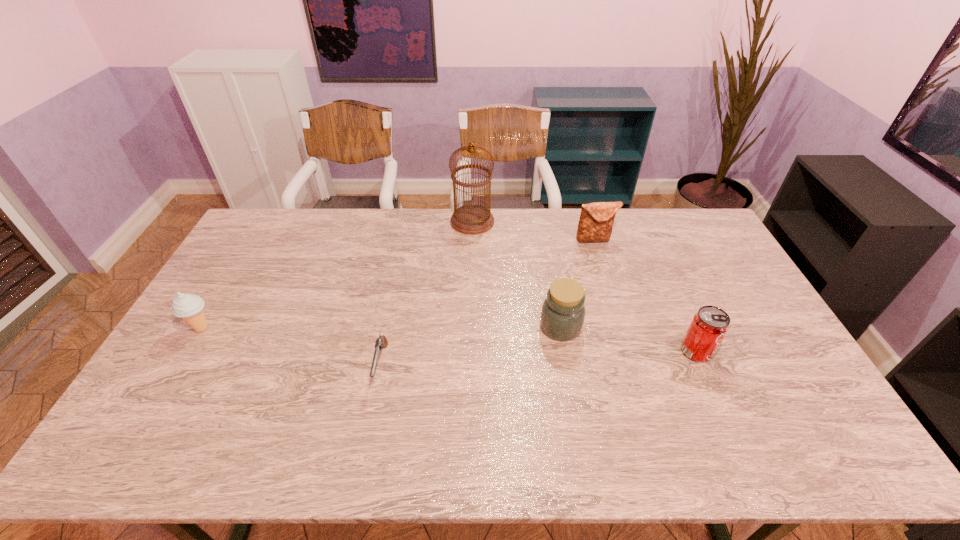
Locate an element on the screen. This screenshot has height=540, width=960. vacant area that lies between the birdcage and the second object from right to left is located at coordinates (534, 231).

Image resolution: width=960 pixels, height=540 pixels. In order to click on vacant area between the third object from right to left and the rightmost object in this screenshot , I will do `click(629, 339)`.

Identify which object is the second closest to the clutch bag. Please provide its 2D coordinates. Your answer should be formatted as a tuple, i.e. [(x, y)], where the tuple contains the x and y coordinates of a point satisfying the conditions above.

[(562, 317)]

Select which object is the closest to the fifth object from left to right. Please provide its 2D coordinates. Your answer should be formatted as a tuple, i.e. [(x, y)], where the tuple contains the x and y coordinates of a point satisfying the conditions above.

[(472, 219)]

You are a GUI agent. You are given a task and a screenshot of the screen. Output one action in this format:
    pyautogui.click(x=<x>, y=<y>)
    Task: Click on the vacant point that satisfies the following two spatial constraints: 1. on the front-facing side of the birdcage; 2. aiming along the barrel of the gun
    This screenshot has height=540, width=960.
    Given the screenshot: What is the action you would take?
    pyautogui.click(x=469, y=364)

Where is `vacant area that satisfies the following two spatial constraints: 1. on the front-facing side of the birdcage; 2. on the right side of the third object from right to left`? The width and height of the screenshot is (960, 540). vacant area that satisfies the following two spatial constraints: 1. on the front-facing side of the birdcage; 2. on the right side of the third object from right to left is located at coordinates pos(470,327).

This screenshot has width=960, height=540. Find the location of `vacant space that satisfies the following two spatial constraints: 1. on the front-facing side of the birdcage; 2. aiming along the barrel of the gun`. vacant space that satisfies the following two spatial constraints: 1. on the front-facing side of the birdcage; 2. aiming along the barrel of the gun is located at coordinates click(469, 364).

The width and height of the screenshot is (960, 540). I want to click on vacant space that satisfies the following two spatial constraints: 1. on the back side of the third object from right to left; 2. on the left side of the icecream, so click(203, 327).